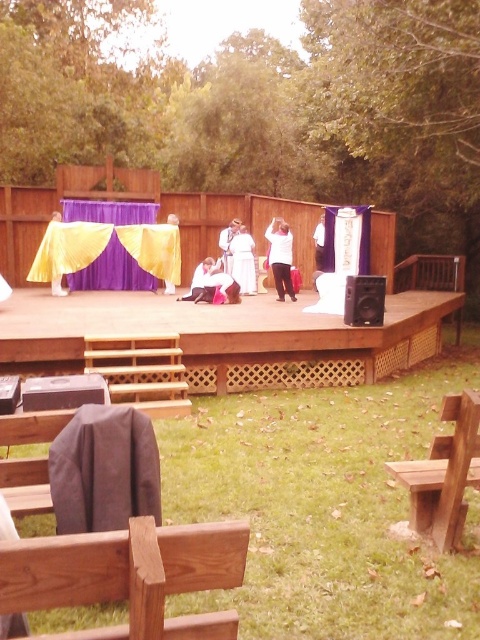
You are organizing a small outdoor event and need to place a 5.5 meter long banner between the wooden bench at lower left and the black plastic speaker at center. Is there enough space to place the banner without bending it?

The distance between the wooden bench at lower left and the black plastic speaker at center is 6.17 meters. Since the banner is 5.5 meters long, there is sufficient space to place it straight without bending.

Looking at this image, you are an attendee at the ceremony and want to take a photo of both the white fabric at center and the yellow satin dress at center. Which object will appear larger in your photo?

The white fabric at center will appear larger in the photo because it is closer to you than the yellow satin dress at center.